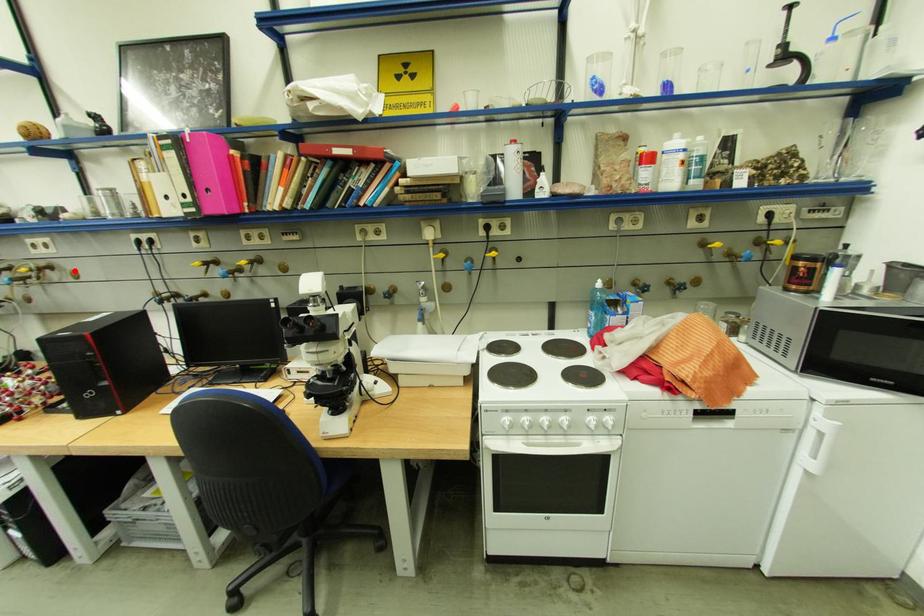
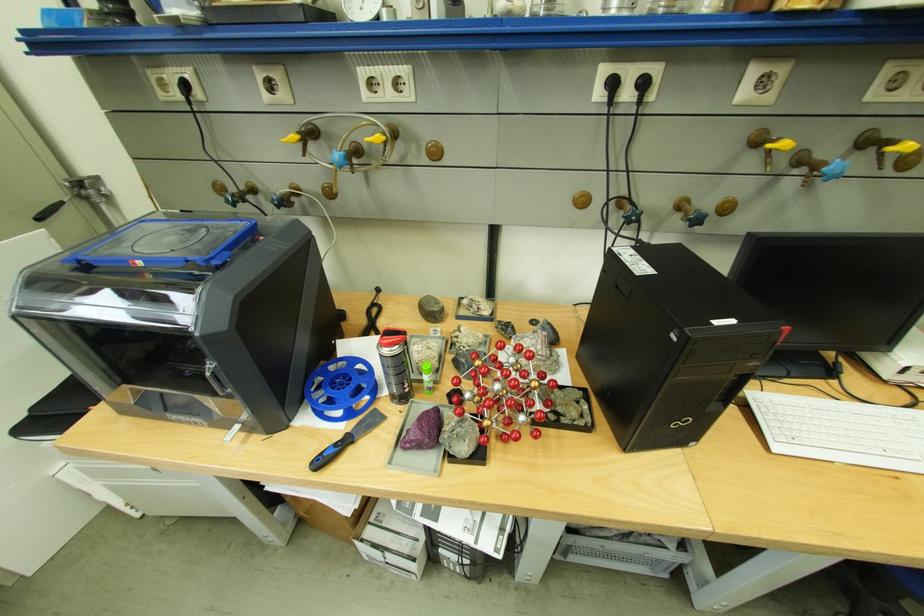
In the second image, find the point that corresponds to the highlighted location in the first image.

(428, 140)